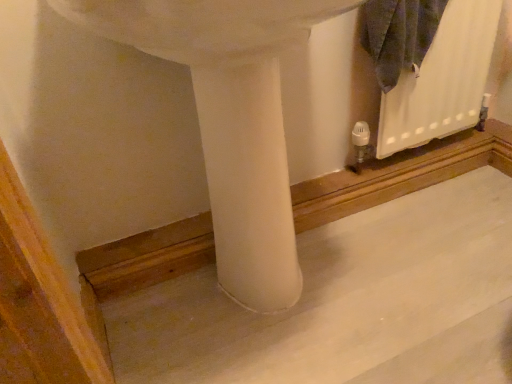
This screenshot has height=384, width=512. In order to click on empty space that is ontop of smooth concrete at center (from a real-world perspective) in this screenshot , I will do click(x=362, y=282).